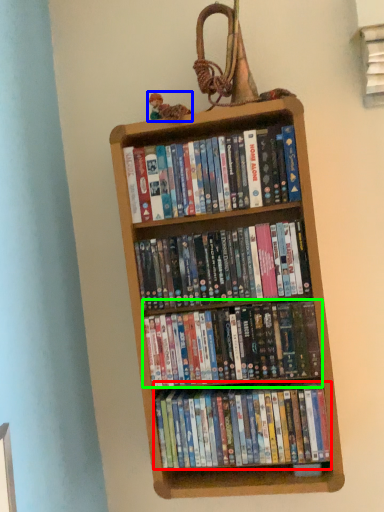
Question: Based on their relative distances, which object is nearer to book (highlighted by a red box)? Choose from toy (highlighted by a blue box) and book (highlighted by a green box).

Choices:
 (A) toy
 (B) book

Answer: (B)